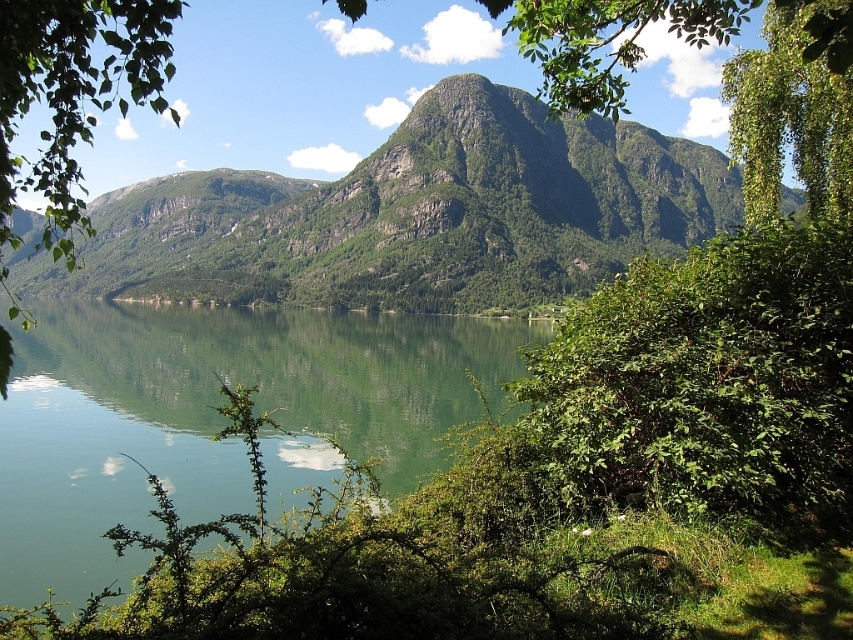
Image resolution: width=853 pixels, height=640 pixels. What do you see at coordinates (215, 417) in the screenshot? I see `green reflective water at center` at bounding box center [215, 417].

Is green reflective water at center thinner than green leafy branch at left?

Indeed, green reflective water at center has a lesser width compared to green leafy branch at left.

Identify the location of green reflective water at center. This screenshot has width=853, height=640. (215, 417).

Where is `green reflective water at center`? The width and height of the screenshot is (853, 640). green reflective water at center is located at coordinates (215, 417).

Does green textured mountain at center have a greater height compared to green reflective water at center?

Indeed, green textured mountain at center has a greater height compared to green reflective water at center.

Is green textured mountain at center shorter than green reflective water at center?

Incorrect, green textured mountain at center's height does not fall short of green reflective water at center's.

The height and width of the screenshot is (640, 853). I want to click on green textured mountain at center, so 413,216.

You are a GUI agent. You are given a task and a screenshot of the screen. Output one action in this format:
    pyautogui.click(x=<x>, y=<y>)
    Task: Click on the green textured mountain at center
    Image resolution: width=853 pixels, height=640 pixels.
    Given the screenshot: What is the action you would take?
    pyautogui.click(x=413, y=216)

Consider the image. Who is higher up, green textured mountain at center or green leafy branch at left?

green textured mountain at center

Does green textured mountain at center come in front of green leafy branch at left?

No, green textured mountain at center is behind green leafy branch at left.

Which is in front, point (398, 298) or point (155, 52)?

Point (155, 52)

At what (x,y) coordinates should I click in order to perform the action: click on green textured mountain at center. Please return your answer as a coordinate pair (x, y). Looking at the image, I should click on tap(413, 216).